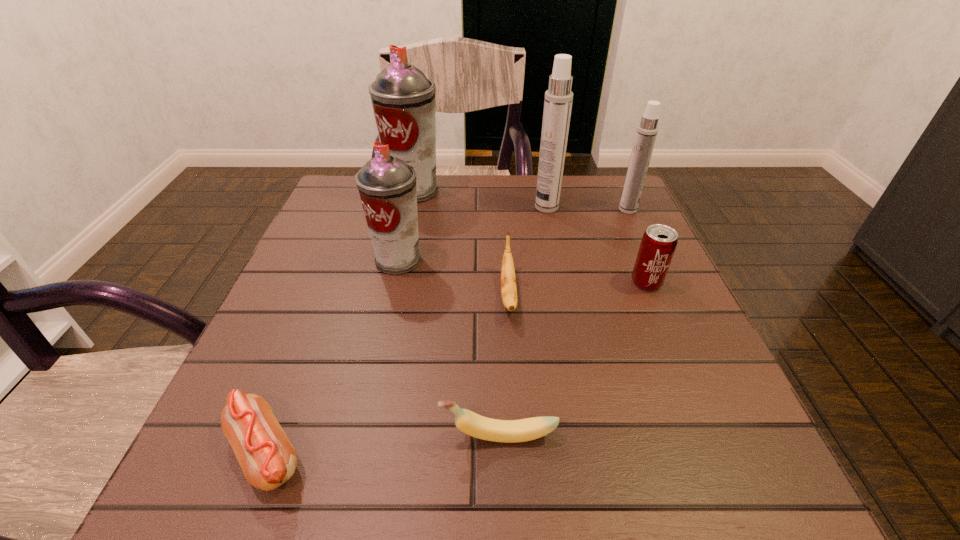
Identify the location of vacant area between the smaller white aerosol can and the beer can. The image size is (960, 540). (637, 246).

Where is `unoccupied area between the shortest object and the farther gray aerosol can`? unoccupied area between the shortest object and the farther gray aerosol can is located at coordinates (340, 322).

The image size is (960, 540). In order to click on vacant area that lies between the bigger gray aerosol can and the brown sausage in this screenshot , I will do `click(340, 322)`.

Where is `free spot between the farther gray aerosol can and the nearer banana`? This screenshot has height=540, width=960. free spot between the farther gray aerosol can and the nearer banana is located at coordinates (456, 313).

This screenshot has height=540, width=960. What are the coordinates of `unoccupied area between the farther banana and the brown sausage` in the screenshot? It's located at (387, 374).

This screenshot has width=960, height=540. Find the location of `free space between the left white aerosol can and the smaller white aerosol can`. free space between the left white aerosol can and the smaller white aerosol can is located at coordinates 588,208.

Identify the location of object that is the seventh closest to the brown sausage. The width and height of the screenshot is (960, 540). coord(647,130).

You are a GUI agent. You are given a task and a screenshot of the screen. Output one action in this format:
    pyautogui.click(x=<x>, y=<y>)
    Task: Click on the object that ranks as the seventh closest to the nearer gray aerosol can
    The width and height of the screenshot is (960, 540).
    Given the screenshot: What is the action you would take?
    pyautogui.click(x=647, y=130)

Image resolution: width=960 pixels, height=540 pixels. Find the location of `aerosol can that stands as the third closest to the third aerosol can from left to right`. aerosol can that stands as the third closest to the third aerosol can from left to right is located at coordinates (387, 186).

Identify the location of aerosol can that is the second closest one to the brown sausage. (403, 99).